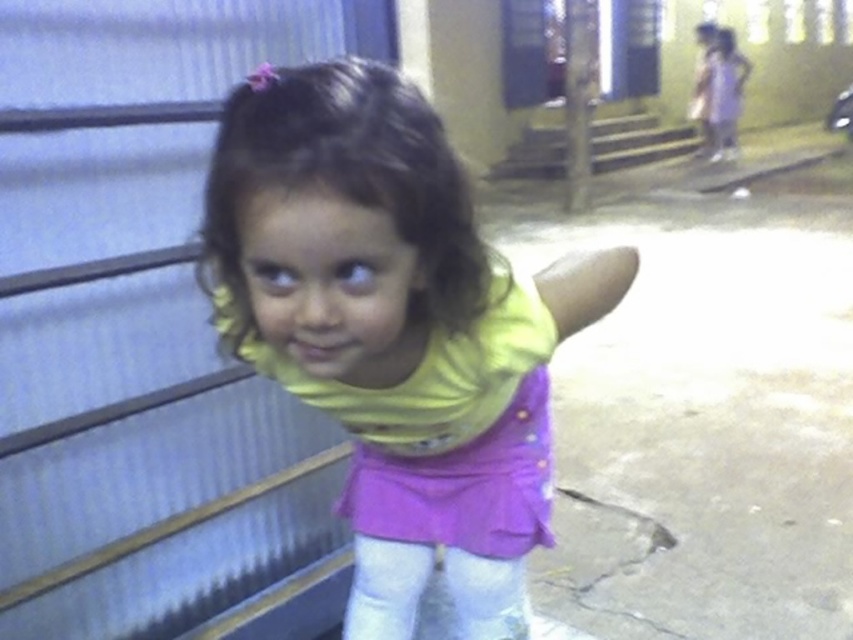
Question: Considering the relative positions of metallic gray garage door at upper left and yellow matte shirt at center in the image provided, where is metallic gray garage door at upper left located with respect to yellow matte shirt at center?

Choices:
 (A) right
 (B) left

Answer: (B)

Question: Does metallic gray garage door at upper left appear on the left side of yellow matte shirt at center?

Choices:
 (A) no
 (B) yes

Answer: (B)

Question: Does metallic gray garage door at upper left appear on the right side of yellow matte shirt at center?

Choices:
 (A) yes
 (B) no

Answer: (B)

Question: Among these points, which one is farthest from the camera?

Choices:
 (A) (337, 40)
 (B) (387, 556)

Answer: (A)

Question: Among these objects, which one is nearest to the camera?

Choices:
 (A) metallic gray garage door at upper left
 (B) yellow matte shirt at center

Answer: (B)